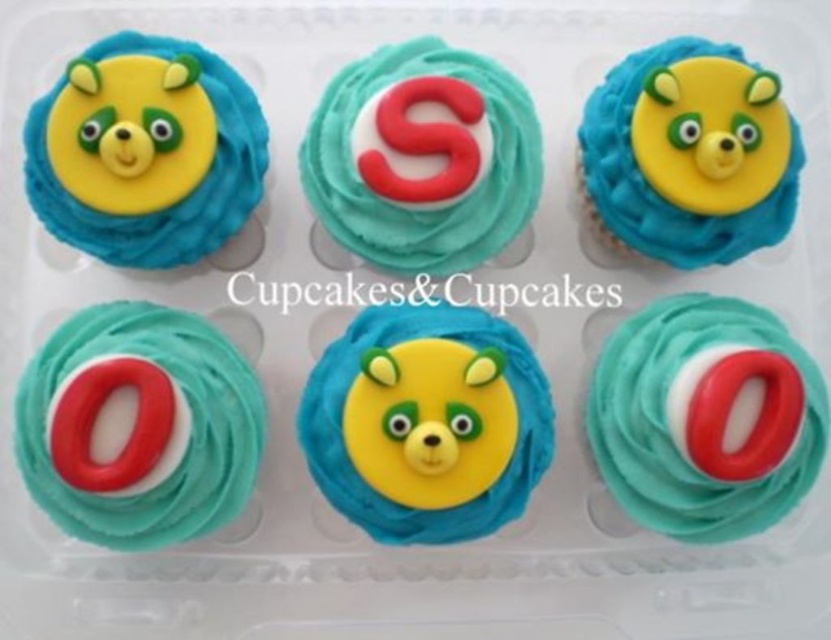
Question: Which point appears closest to the camera in this image?

Choices:
 (A) (180, 170)
 (B) (140, 371)
 (C) (475, 262)
 (D) (495, 515)

Answer: (B)

Question: Which of these objects is positioned farthest from the teal matte frosting at center?

Choices:
 (A) teal matte icing at center left
 (B) matte yellow bear at upper right
 (C) teal matte frosting at bottom right

Answer: (A)

Question: Is teal matte icing at center left below teal matte frosting at bottom right?

Choices:
 (A) no
 (B) yes

Answer: (B)

Question: Can you confirm if matte yellow bear at upper left is thinner than teal matte frosting at center?

Choices:
 (A) yes
 (B) no

Answer: (A)

Question: Which object is positioned closest to the matte yellow bear at upper left?

Choices:
 (A) matte yellow bear at upper right
 (B) yellow fondant bear at center
 (C) teal matte frosting at bottom right

Answer: (B)

Question: Does teal matte icing at center left have a larger size compared to teal matte frosting at bottom right?

Choices:
 (A) no
 (B) yes

Answer: (A)